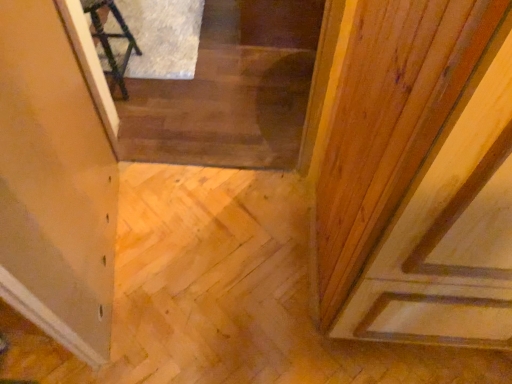
Question: From the image's perspective, would you say wooden stairs at center is shown under dark wood chair at upper left?

Choices:
 (A) yes
 (B) no

Answer: (A)

Question: Considering the relative positions of wooden stairs at center and dark wood chair at upper left in the image provided, is wooden stairs at center to the left of dark wood chair at upper left from the viewer's perspective?

Choices:
 (A) yes
 (B) no

Answer: (B)

Question: Considering the relative sizes of wooden stairs at center and dark wood chair at upper left in the image provided, is wooden stairs at center wider than dark wood chair at upper left?

Choices:
 (A) yes
 (B) no

Answer: (A)

Question: Is wooden stairs at center at the right side of dark wood chair at upper left?

Choices:
 (A) no
 (B) yes

Answer: (B)

Question: Is dark wood chair at upper left located within wooden stairs at center?

Choices:
 (A) no
 (B) yes

Answer: (A)

Question: From a real-world perspective, is transparent glass door at upper left above or below dark wood chair at upper left?

Choices:
 (A) below
 (B) above

Answer: (B)

Question: Considering the positions of transparent glass door at upper left and dark wood chair at upper left in the image, is transparent glass door at upper left wider or thinner than dark wood chair at upper left?

Choices:
 (A) thin
 (B) wide

Answer: (A)

Question: Is transparent glass door at upper left to the left or to the right of dark wood chair at upper left in the image?

Choices:
 (A) right
 (B) left

Answer: (A)

Question: Is point pyautogui.click(x=28, y=81) closer or farther from the camera than point pyautogui.click(x=132, y=41)?

Choices:
 (A) farther
 (B) closer

Answer: (B)

Question: From a real-world perspective, is dark wood chair at upper left above or below transparent glass door at upper left?

Choices:
 (A) below
 (B) above

Answer: (A)

Question: Based on their positions, is dark wood chair at upper left located to the left or right of transparent glass door at upper left?

Choices:
 (A) left
 (B) right

Answer: (A)

Question: Is dark wood chair at upper left bigger or smaller than transparent glass door at upper left?

Choices:
 (A) big
 (B) small

Answer: (B)

Question: Choose the correct answer: Is dark wood chair at upper left inside transparent glass door at upper left or outside it?

Choices:
 (A) outside
 (B) inside

Answer: (A)

Question: Considering the positions of point (234, 107) and point (109, 306), is point (234, 107) closer or farther from the camera than point (109, 306)?

Choices:
 (A) closer
 (B) farther

Answer: (B)

Question: Is wooden stairs at center bigger or smaller than transparent glass door at upper left?

Choices:
 (A) big
 (B) small

Answer: (A)